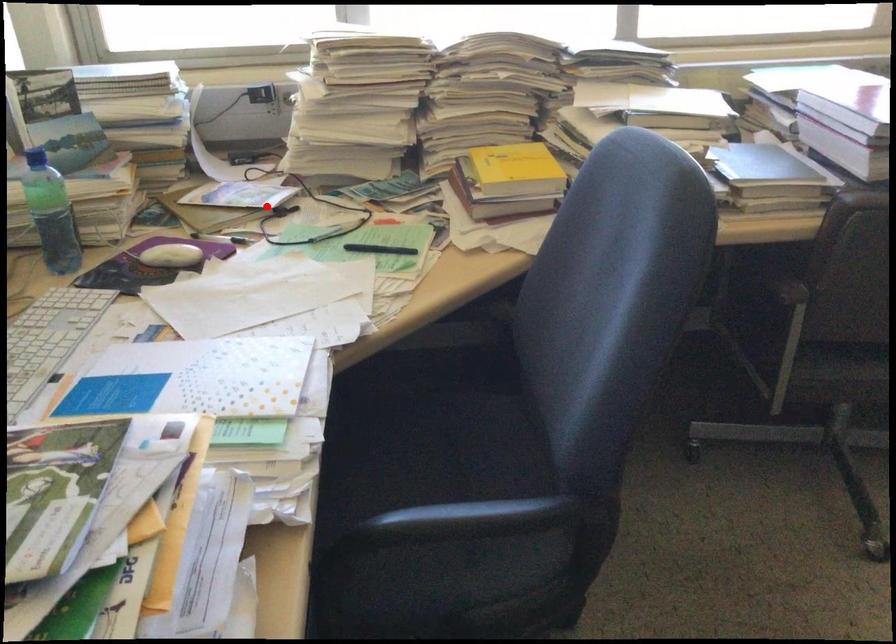
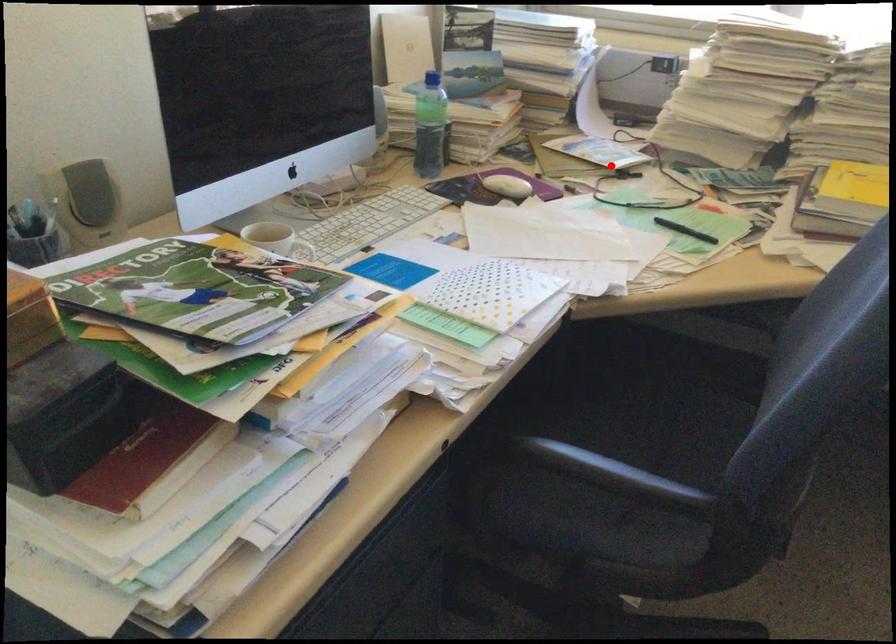
I am providing you with two images of the same scene from different viewpoints. A red point is marked on the first image and another point is marked on the second image. Do the highlighted points in image1 and image2 indicate the same real-world spot?

Yes